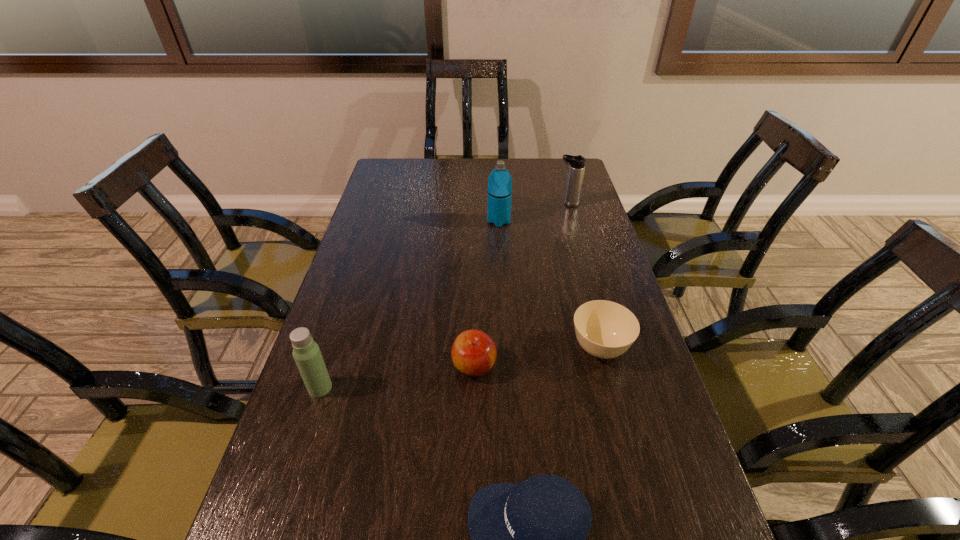
Where is `blank space located on the handle side of the rightmost thermos bottle`? This screenshot has width=960, height=540. blank space located on the handle side of the rightmost thermos bottle is located at coordinates (492, 204).

Identify the location of vacant area located on the handle side of the rightmost thermos bottle. (507, 204).

This screenshot has width=960, height=540. Identify the location of free location located 0.190m on the front of the leftmost thermos bottle. (289, 484).

Locate an element on the screen. The image size is (960, 540). free space located on the right of the apple is located at coordinates (594, 366).

Where is `free space located 0.360m on the left of the sugar bowl`? free space located 0.360m on the left of the sugar bowl is located at coordinates tap(422, 349).

Find the location of a particular element. Image resolution: width=960 pixels, height=540 pixels. object that is at the left edge is located at coordinates (306, 352).

You are a GUI agent. You are given a task and a screenshot of the screen. Output one action in this format:
    pyautogui.click(x=<x>, y=<y>)
    Task: Click on the thermos bottle at the right edge
    This screenshot has width=960, height=540.
    Given the screenshot: What is the action you would take?
    pyautogui.click(x=577, y=163)

You are a GUI agent. You are given a task and a screenshot of the screen. Output one action in this format:
    pyautogui.click(x=<x>, y=<y>)
    Task: Click on the sugar bowl present at the right edge
    The height and width of the screenshot is (540, 960).
    Given the screenshot: What is the action you would take?
    pyautogui.click(x=604, y=329)

The height and width of the screenshot is (540, 960). Identify the location of vacant space at the far edge of the desktop. (461, 172).

In the image, there is a desktop. At what (x,y) coordinates should I click in order to perform the action: click on vacant space at the left edge. Please return your answer as a coordinate pair (x, y). The width and height of the screenshot is (960, 540). Looking at the image, I should click on (392, 241).